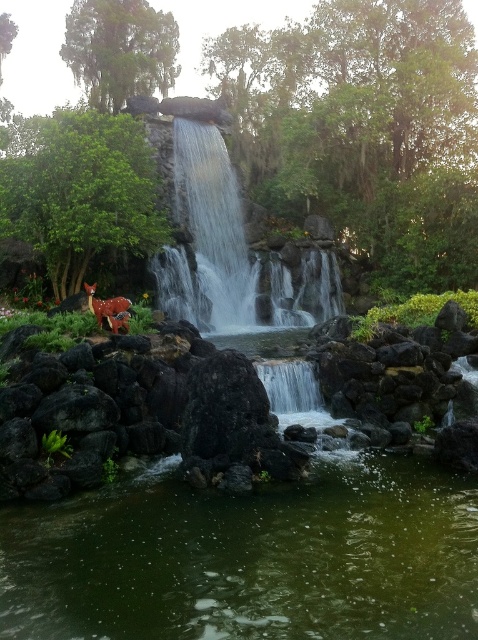
You are an artist planning to paint this scene. You want to ensure the spotted deer at lower left is visible next to the translucent glass waterfall at center. Given their sizes, which object should you paint first to maintain depth perception?

You should paint the spotted deer at lower left first because the translucent glass waterfall at center is wider than the spotted deer at lower left, so painting the larger object first helps in maintaining depth perception by ensuring the smaller object appears in front.

You are standing at the edge of the waterfall and want to cross to the other side. There is a small decorative deer figure nearby. Which direction should you go to avoid the green liquid water at center bottom and the clear water at center?

You should go around the green liquid water at center bottom and clear water at center by moving to the side of the waterfall where the small decorative deer figure is located, as it is positioned near the edge and away from the main water flow.